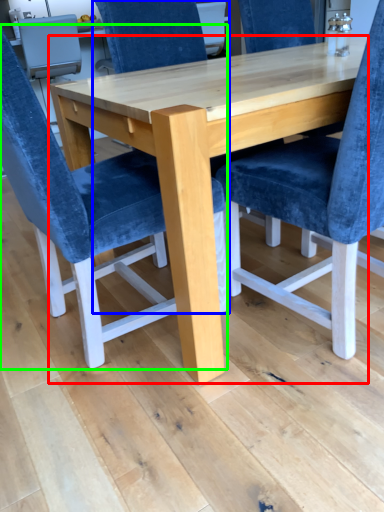
Question: Based on their relative distances, which object is nearer to table (highlighted by a red box)? Choose from chair (highlighted by a blue box) and chair (highlighted by a green box).

Choices:
 (A) chair
 (B) chair

Answer: (B)